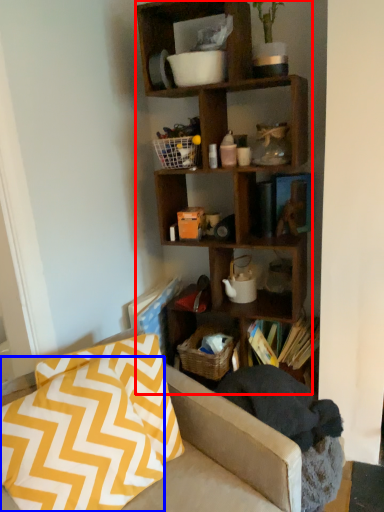
Question: Which object is closer to the camera taking this photo, shelf (highlighted by a red box) or pillow (highlighted by a blue box)?

Choices:
 (A) shelf
 (B) pillow

Answer: (B)